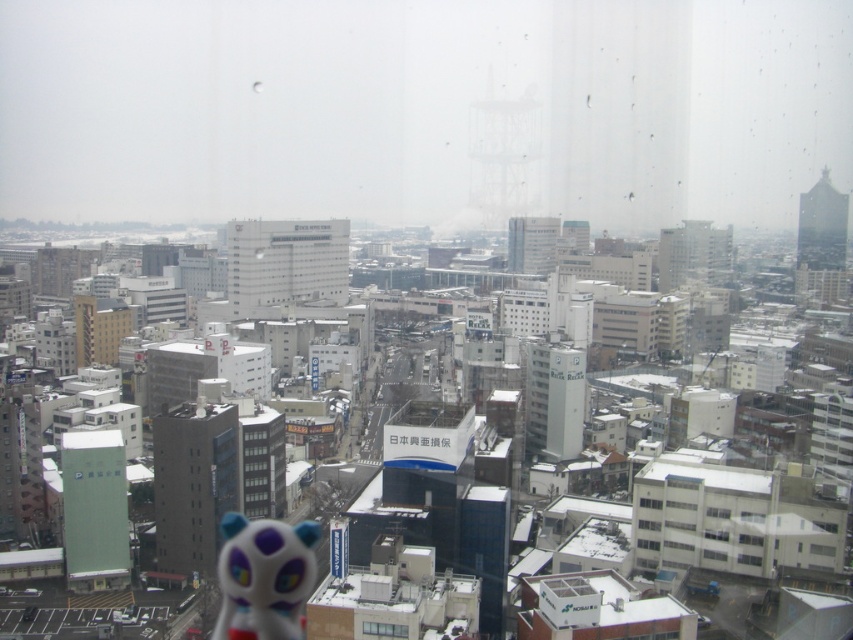
You are a delivery drone that needs to deliver a package to the transparent glass window at center. You see the white glossy toy at lower center in your path. Can you safely navigate around it to reach the window?

The white glossy toy at lower center is positioned on the left side of the transparent glass window at center, so the drone can safely navigate around it by moving to the right side of the toy to reach the window.

You are standing at a window overlooking the city. There is a point marked at coordinates (227,531) in the scene. If you want to throw a small pebble to hit that point, considering the distance, is it feasible for you to do so from your current position?

The point at coordinates (227,531) is 497.55 feet away from the viewer. Throwing a pebble that distance is not feasible as the average human cannot throw an object that far.

You are an architect reviewing a cityscape design. You notice two points labeled as point 1 and point 2 in the image. Point 1 is at coordinates point (231, 573) and point 2 is at point (376, 625). Based on the perspective, which point is closer to the window from which the photo was taken?

Point (231, 573) is closer to the window because it is further to the viewer than point (376, 625).